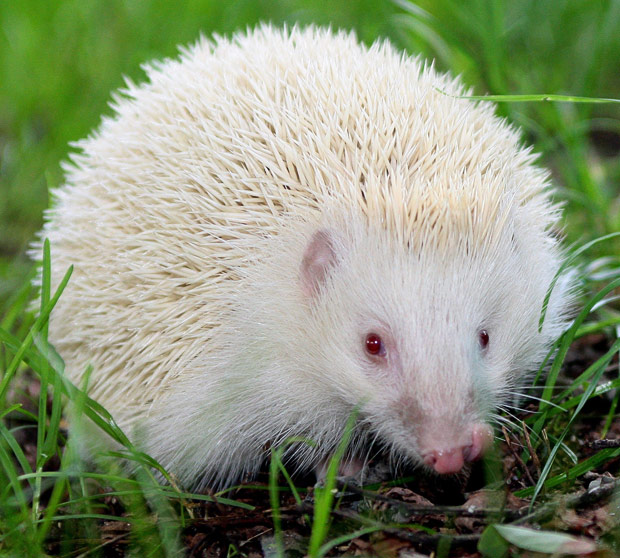
The height and width of the screenshot is (558, 620). I want to click on white fur, so click(240, 376), click(426, 307), click(515, 295).